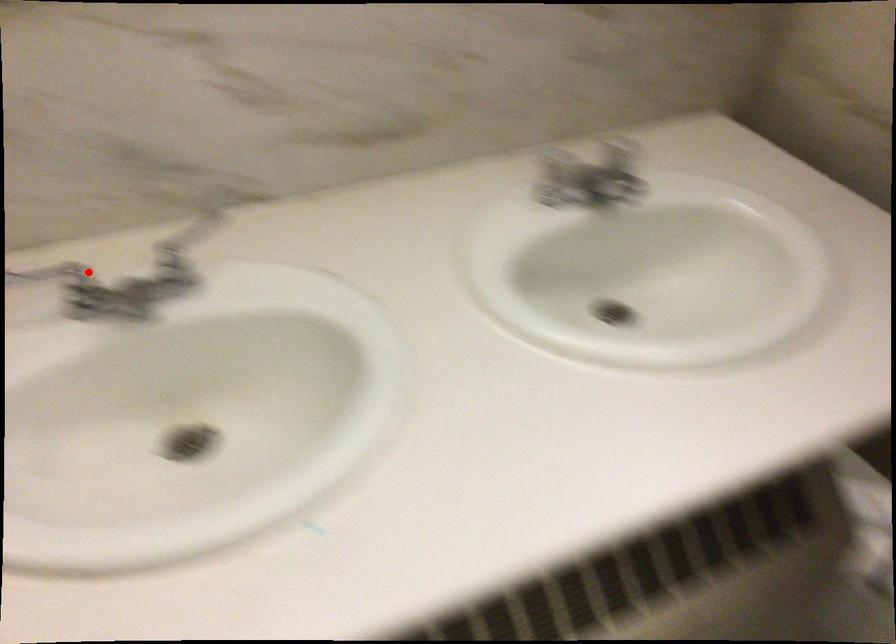
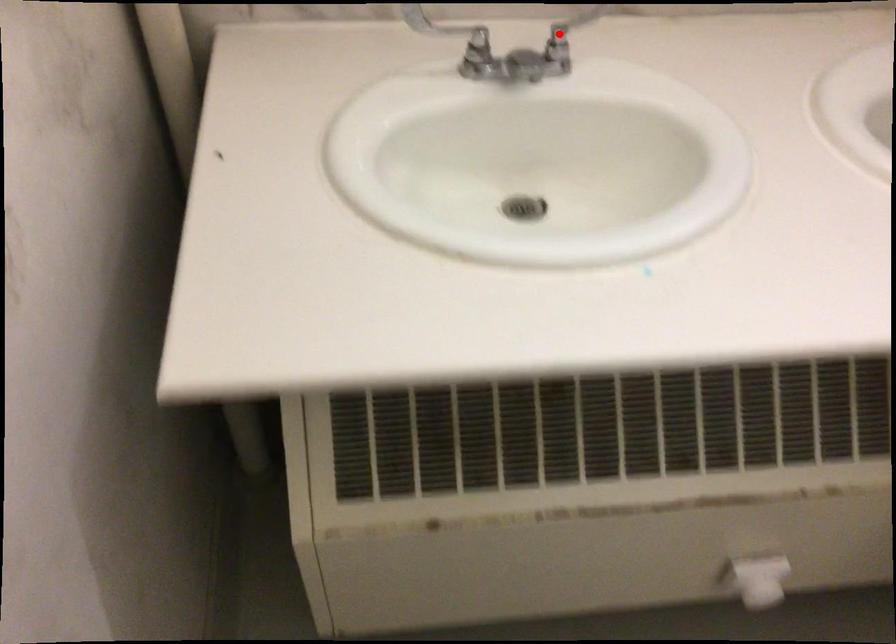
I am providing you with two images of the same scene from different viewpoints. A red point is marked on the first image and another point is marked on the second image. Are the points marked in image1 and image2 representing the same 3D position?

No